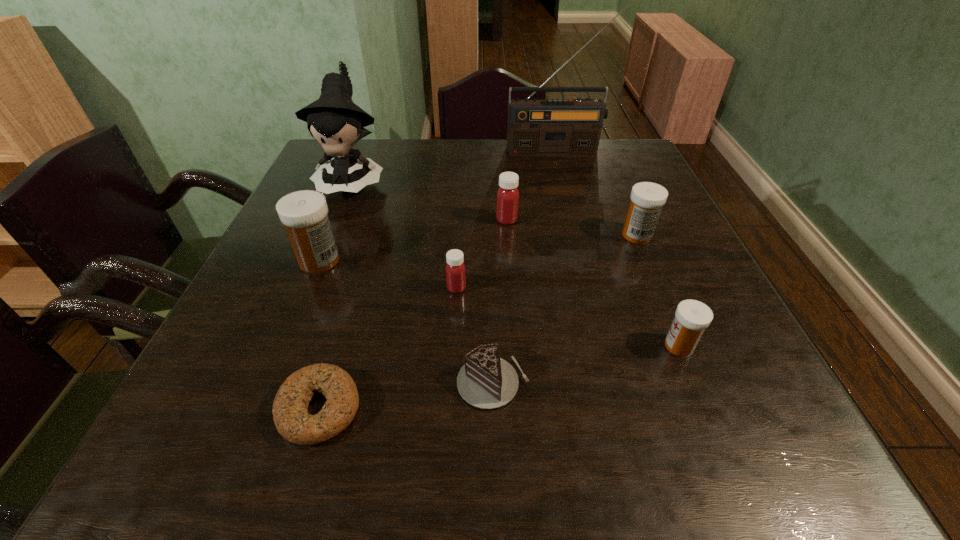
Identify the location of bagel that is at the left edge. (290, 412).

Image resolution: width=960 pixels, height=540 pixels. I want to click on radio receiver at the right edge, so click(x=536, y=127).

Locate an element on the screen. Image resolution: width=960 pixels, height=540 pixels. object that is at the far left corner is located at coordinates click(333, 120).

Identify the location of object situated at the near left corner. The width and height of the screenshot is (960, 540). (290, 412).

Where is `object that is positioned at the far right corner`? This screenshot has width=960, height=540. object that is positioned at the far right corner is located at coordinates (536, 127).

Locate an element on the screen. vacant space at the far edge is located at coordinates (385, 146).

Where is `free spot at the near edge of the desktop`? Image resolution: width=960 pixels, height=540 pixels. free spot at the near edge of the desktop is located at coordinates (401, 461).

Image resolution: width=960 pixels, height=540 pixels. Find the location of `vacant region at the left edge`. vacant region at the left edge is located at coordinates (285, 326).

Identify the location of free location at the right edge of the desktop. Image resolution: width=960 pixels, height=540 pixels. (691, 246).

Find the location of a particular element. vacant space at the near left corner of the desktop is located at coordinates coord(247,443).